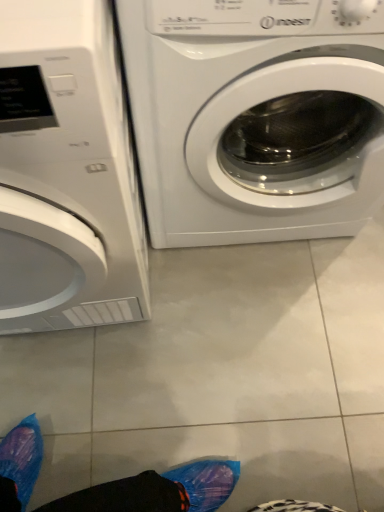
Question: Is white glossy washing machine at center, the 2th washing machine in the left-to-right sequence, outside of white glossy washing machine at left, the first washing machine in the left-to-right sequence?

Choices:
 (A) yes
 (B) no

Answer: (A)

Question: Are white glossy washing machine at center, the 2th washing machine in the left-to-right sequence, and white glossy washing machine at left, the first washing machine in the left-to-right sequence, making contact?

Choices:
 (A) no
 (B) yes

Answer: (A)

Question: From the image's perspective, is white glossy washing machine at center, the 1th washing machine positioned from the right, located above white glossy washing machine at left, the first washing machine in the left-to-right sequence?

Choices:
 (A) no
 (B) yes

Answer: (B)

Question: Can you confirm if white glossy washing machine at center, the 2th washing machine in the left-to-right sequence, is wider than white glossy washing machine at left, which ranks as the 2th washing machine in right-to-left order?

Choices:
 (A) yes
 (B) no

Answer: (B)

Question: Is white glossy washing machine at center, the 1th washing machine positioned from the right, facing towards white glossy washing machine at left, the first washing machine in the left-to-right sequence?

Choices:
 (A) yes
 (B) no

Answer: (B)

Question: From a real-world perspective, is white glossy washing machine at center, the 2th washing machine in the left-to-right sequence, positioned under white glossy washing machine at left, the first washing machine in the left-to-right sequence, based on gravity?

Choices:
 (A) yes
 (B) no

Answer: (A)

Question: From the image's perspective, would you say white glossy washing machine at left, the first washing machine in the left-to-right sequence, is shown under white glossy washing machine at center, the 2th washing machine in the left-to-right sequence?

Choices:
 (A) no
 (B) yes

Answer: (B)

Question: Is white glossy washing machine at left, which ranks as the 2th washing machine in right-to-left order, aimed at white glossy washing machine at center, the 2th washing machine in the left-to-right sequence?

Choices:
 (A) no
 (B) yes

Answer: (A)

Question: Is white glossy washing machine at left, the first washing machine in the left-to-right sequence, positioned before white glossy washing machine at center, the 1th washing machine positioned from the right?

Choices:
 (A) yes
 (B) no

Answer: (A)

Question: Is white glossy washing machine at left, the first washing machine in the left-to-right sequence, taller than white glossy washing machine at center, the 2th washing machine in the left-to-right sequence?

Choices:
 (A) yes
 (B) no

Answer: (A)

Question: Is white glossy washing machine at left, which ranks as the 2th washing machine in right-to-left order, at the right side of white glossy washing machine at center, the 2th washing machine in the left-to-right sequence?

Choices:
 (A) no
 (B) yes

Answer: (A)

Question: Considering the relative sizes of white glossy washing machine at left, which ranks as the 2th washing machine in right-to-left order, and white glossy washing machine at center, the 1th washing machine positioned from the right, in the image provided, is white glossy washing machine at left, which ranks as the 2th washing machine in right-to-left order, smaller than white glossy washing machine at center, the 1th washing machine positioned from the right,?

Choices:
 (A) yes
 (B) no

Answer: (B)

Question: In terms of size, does white glossy washing machine at left, which ranks as the 2th washing machine in right-to-left order, appear bigger or smaller than white glossy washing machine at center, the 1th washing machine positioned from the right?

Choices:
 (A) small
 (B) big

Answer: (B)